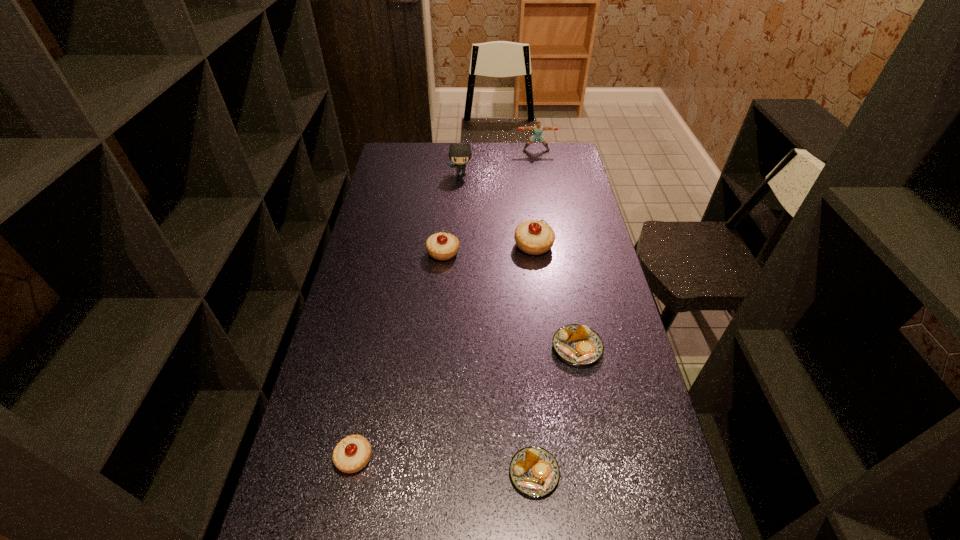
Locate an element on the screen. pastry that is the second nearest to the smallest beige pastry is located at coordinates (579, 345).

Image resolution: width=960 pixels, height=540 pixels. I want to click on pastry that is the second closest to the second pastry from left to right, so click(x=579, y=345).

Locate an element on the screen. This screenshot has width=960, height=540. beige pastry that is the closest to the biggest beige pastry is located at coordinates (441, 246).

Choose which beige pastry is the third nearest neighbor to the gray kitten. Please provide its 2D coordinates. Your answer should be formatted as a tuple, i.e. [(x, y)], where the tuple contains the x and y coordinates of a point satisfying the conditions above.

[(351, 454)]

Choose which brown pastry is the nearest neighbor to the puncher. Please provide its 2D coordinates. Your answer should be formatted as a tuple, i.e. [(x, y)], where the tuple contains the x and y coordinates of a point satisfying the conditions above.

[(579, 345)]